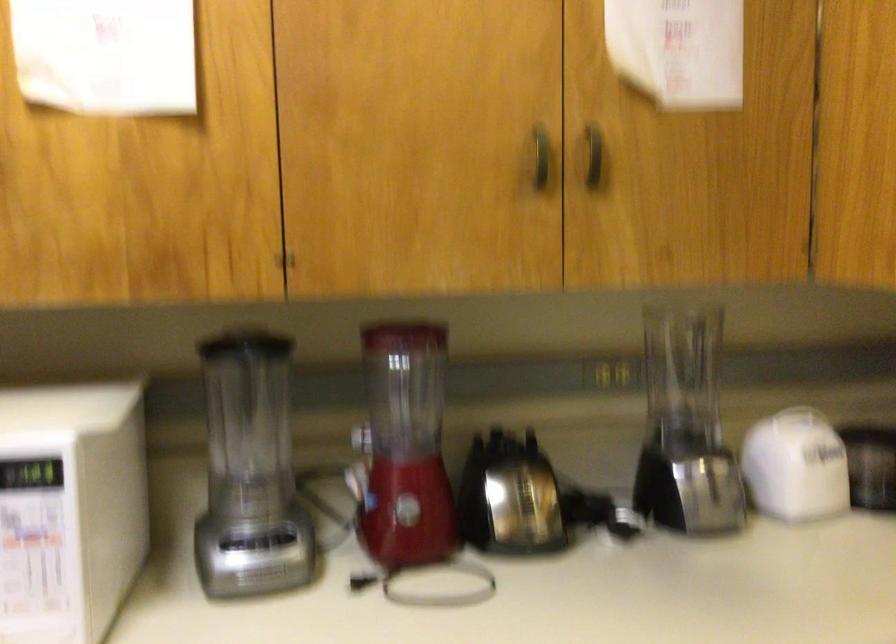
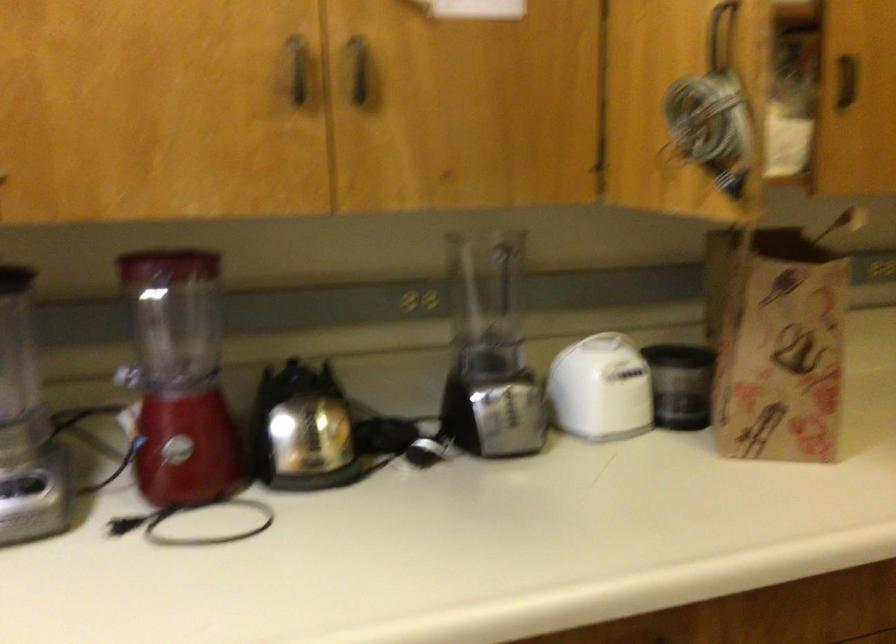
Locate, in the second image, the point that corresponds to [540,166] in the first image.

(297, 69)